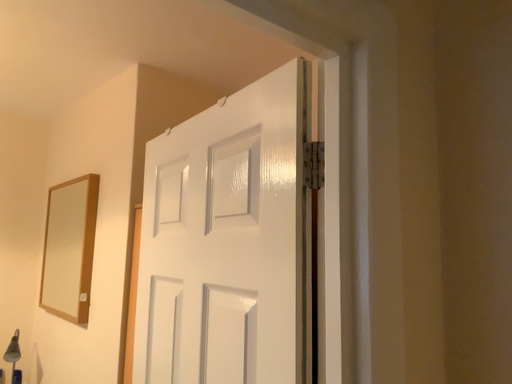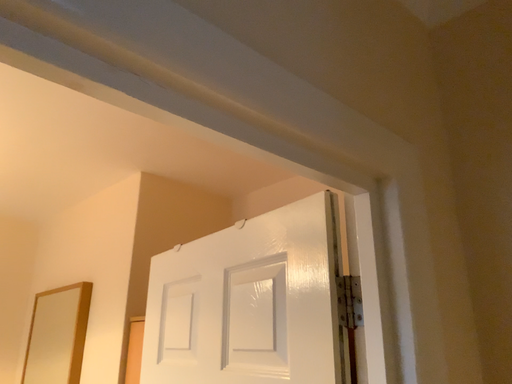
Question: How did the camera likely rotate when shooting the video?

Choices:
 (A) rotated downward
 (B) rotated upward

Answer: (B)